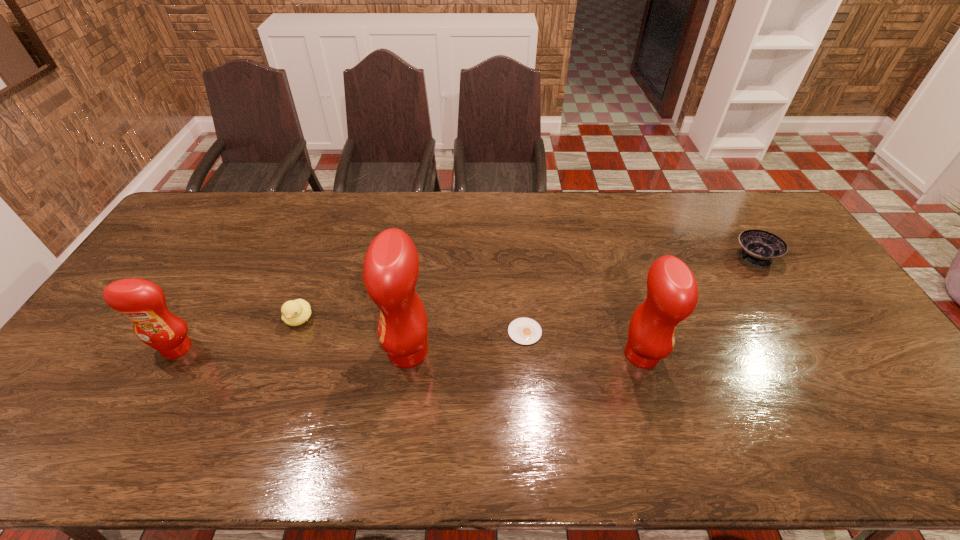
Locate an element on the screen. Image resolution: width=960 pixels, height=540 pixels. blank region between the leftmost object and the third object from right to left is located at coordinates (351, 340).

Image resolution: width=960 pixels, height=540 pixels. I want to click on vacant space that's between the fifth shortest object and the shortest object, so click(583, 343).

This screenshot has width=960, height=540. What are the coordinates of `free space between the bowl and the shortest object` in the screenshot? It's located at (639, 295).

At what (x,y) coordinates should I click in order to perform the action: click on vacant space that's between the farthest object and the tallest object. Please return your answer as a coordinate pair (x, y). The height and width of the screenshot is (540, 960). Looking at the image, I should click on (581, 305).

Identify which object is located as the third nearest to the shortest condiment. Please provide its 2D coordinates. Your answer should be formatted as a tuple, i.e. [(x, y)], where the tuple contains the x and y coordinates of a point satisfying the conditions above.

[(526, 331)]

Identify which object is the third closest to the leftmost condiment. Please provide its 2D coordinates. Your answer should be formatted as a tuple, i.e. [(x, y)], where the tuple contains the x and y coordinates of a point satisfying the conditions above.

[(526, 331)]

Identify the location of condiment that is the second closest to the rightmost condiment. (142, 301).

Where is `condiment that is the third closest to the egg yolk`? condiment that is the third closest to the egg yolk is located at coordinates (142, 301).

I want to click on free location that satisfies the following two spatial constraints: 1. on the front side of the bowl; 2. on the label side of the fourth object from right to left, so click(813, 352).

Image resolution: width=960 pixels, height=540 pixels. In order to click on free space that satisfies the following two spatial constraints: 1. at the beak of the duckling; 2. on the right side of the third object from right to left in this screenshot , I will do `click(294, 332)`.